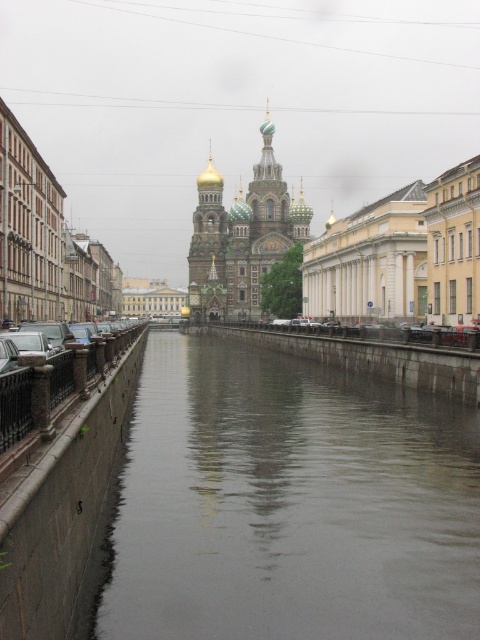
Which is behind, point (164, 436) or point (305, 216)?

Positioned behind is point (305, 216).

Is point (294, 582) closer to viewer compared to point (231, 246)?

Yes, it is.

Between point (408, 540) and point (197, 301), which one is positioned behind?

Positioned behind is point (197, 301).

Locate an element on the screen. The height and width of the screenshot is (640, 480). smooth concrete river at center is located at coordinates (289, 502).